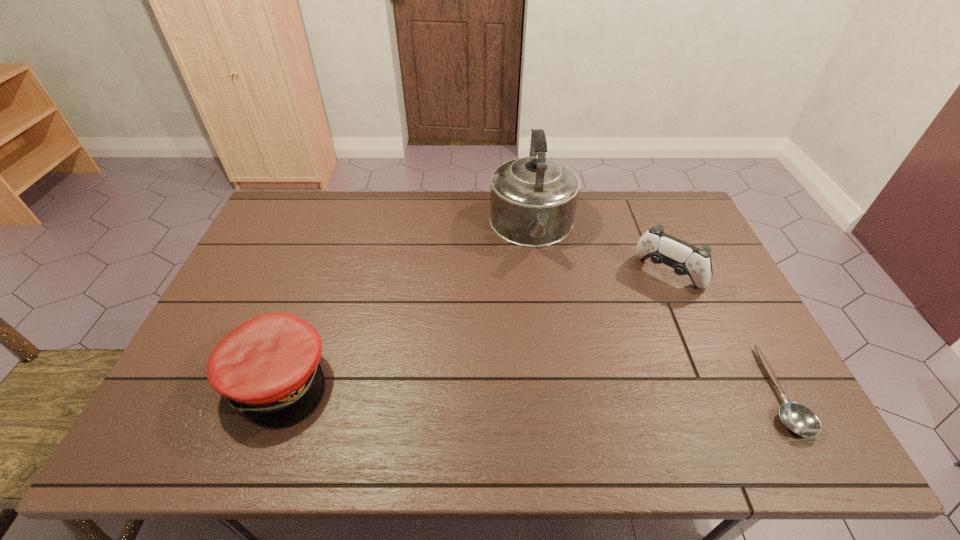
What are the coordinates of `cap` in the screenshot? It's located at (268, 367).

In order to click on the second shortest object in this screenshot , I will do `click(268, 367)`.

Where is `ladle`? The width and height of the screenshot is (960, 540). ladle is located at coordinates (799, 419).

Where is `the shortest object`? the shortest object is located at coordinates (799, 419).

I want to click on the third object from left to right, so click(686, 259).

In order to click on control in this screenshot , I will do `click(686, 259)`.

Identify the location of the tallest object. (533, 199).

Identify the location of the third object from right to left. This screenshot has height=540, width=960. (533, 199).

This screenshot has height=540, width=960. What are the coordinates of `vacant region located at the front of the second shortest object where the visor is located` in the screenshot? It's located at (357, 380).

Where is `vacant space situated 0.080m on the left of the shortest object`? This screenshot has width=960, height=540. vacant space situated 0.080m on the left of the shortest object is located at coordinates click(727, 391).